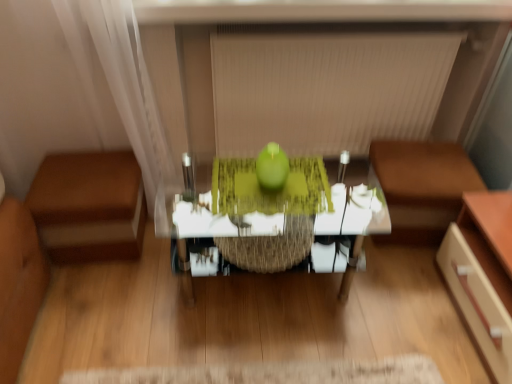
You are a GUI agent. You are given a task and a screenshot of the screen. Output one action in this format:
    pyautogui.click(x=<x>, y=<y>)
    Task: Click on the free point above translucent glass table at center (from a real-world perspective)
    The width and height of the screenshot is (512, 384).
    Given the screenshot: What is the action you would take?
    pyautogui.click(x=269, y=190)